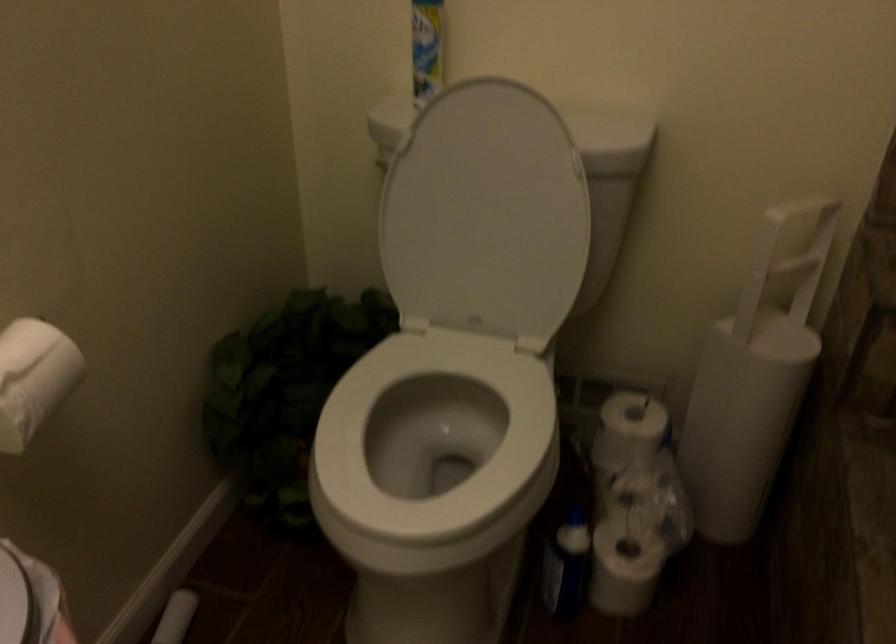
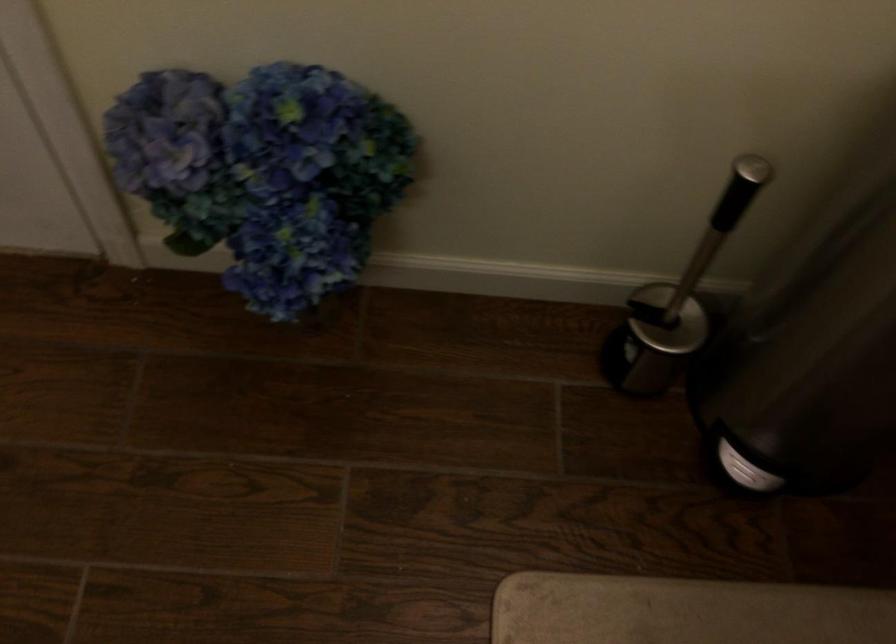
Based on the continuous images, in which direction is the camera rotating?

The camera rotated toward left-down.